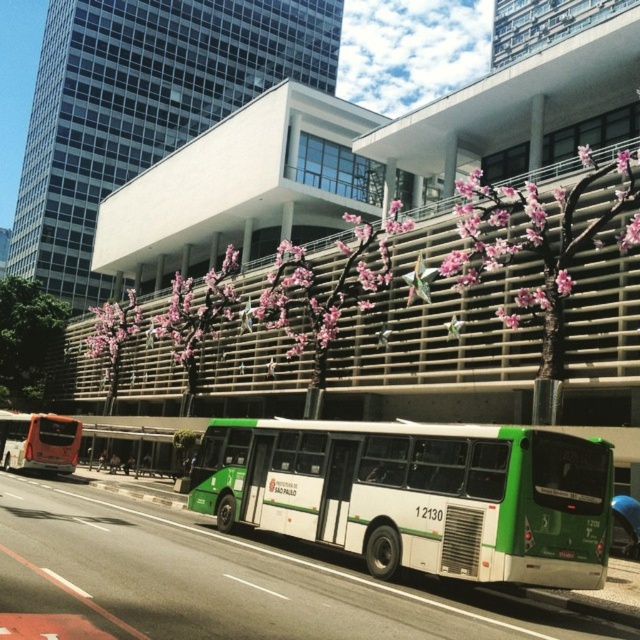
Question: Can you confirm if green matte bus at center is smaller than green plastic bus stop at lower left?

Choices:
 (A) yes
 (B) no

Answer: (A)

Question: Is green matte bus at center thinner than green plastic bus stop at lower left?

Choices:
 (A) no
 (B) yes

Answer: (B)

Question: Which object is the closest to the green matte bus at center?

Choices:
 (A) green leafy tree at lower left
 (B) pink blossom tree at center

Answer: (B)

Question: Can you confirm if green leafy tree at lower left is positioned to the right of orange matte truck at lower left?

Choices:
 (A) yes
 (B) no

Answer: (B)

Question: Which object is closer to the camera taking this photo?

Choices:
 (A) green plastic bus stop at lower left
 (B) orange matte truck at lower left
 (C) pink blossom tree at center
 (D) green leafy tree at lower left

Answer: (B)

Question: Which of the following is the closest to the observer?

Choices:
 (A) pink blossom tree at center
 (B) green matte bus at center
 (C) green plastic bus stop at lower left

Answer: (B)